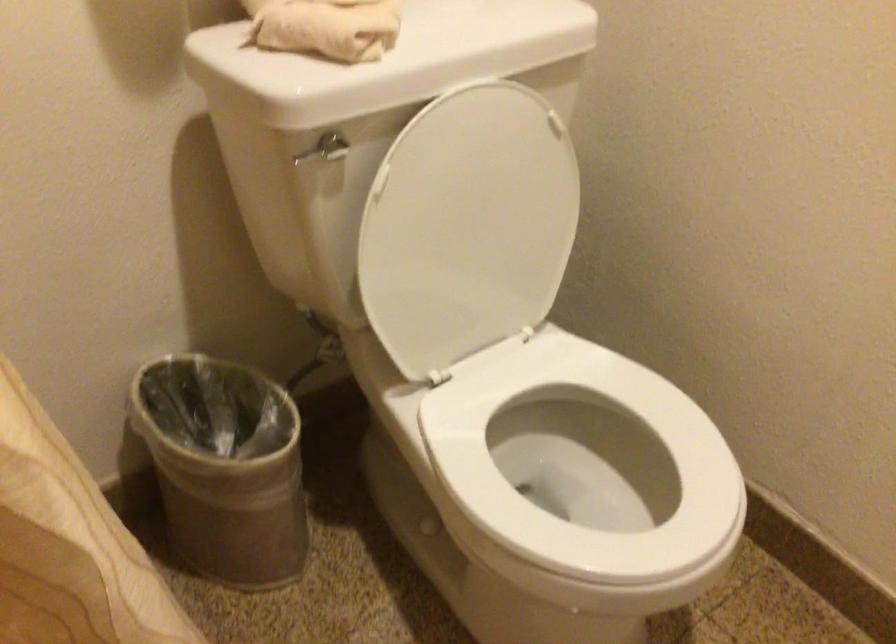
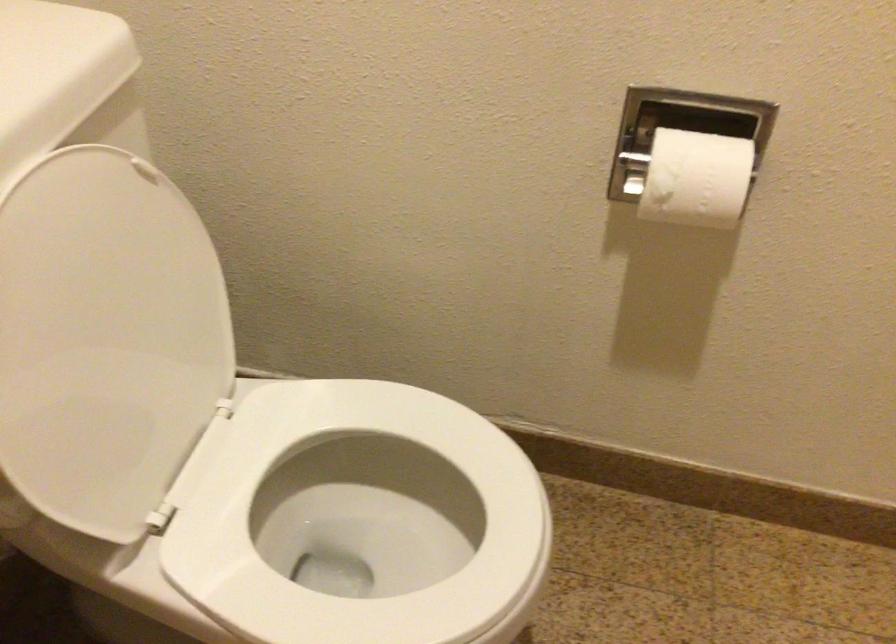
Question: How did the camera likely rotate?

Choices:
 (A) Left
 (B) Right
 (C) Up
 (D) Down

Answer: (B)